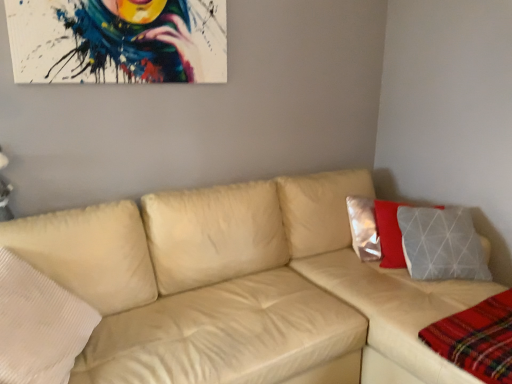
Find the location of a particular element. Image resolution: width=512 pixels, height=384 pixels. beige leather couch at center is located at coordinates (238, 286).

What do you see at coordinates (238, 286) in the screenshot? I see `beige leather couch at center` at bounding box center [238, 286].

In order to face beige leather couch at center, should I rotate leftwards or rightwards?

Turn right by 8.333 degrees to look at beige leather couch at center.

Describe the element at coordinates (477, 339) in the screenshot. I see `plaid fabric at lower right` at that location.

At what (x,y) coordinates should I click in order to perform the action: click on plaid fabric at lower right. Please return your answer as a coordinate pair (x, y). The height and width of the screenshot is (384, 512). Looking at the image, I should click on (477, 339).

Find the location of `beige leather couch at center`. beige leather couch at center is located at coordinates (238, 286).

Can you confirm if plaid fabric at lower right is positioned to the left of beige leather couch at center?

Incorrect, plaid fabric at lower right is not on the left side of beige leather couch at center.

Looking at this image, between plaid fabric at lower right and beige leather couch at center, which one is positioned in front?

Positioned in front is beige leather couch at center.

Does point (493, 320) appear closer or farther from the camera than point (50, 271)?

Point (493, 320) is farther from the camera than point (50, 271).

From the image's perspective, is plaid fabric at lower right below beige leather couch at center?

Yes.

From a real-world perspective, is plaid fabric at lower right above or below beige leather couch at center?

plaid fabric at lower right is situated higher than beige leather couch at center in the real world.

In the scene shown: Can you confirm if plaid fabric at lower right is thinner than beige leather couch at center?

Indeed, plaid fabric at lower right has a lesser width compared to beige leather couch at center.

Can you confirm if plaid fabric at lower right is taller than beige leather couch at center?

Incorrect, the height of plaid fabric at lower right is not larger of that of beige leather couch at center.

Is plaid fabric at lower right bigger or smaller than beige leather couch at center?

Clearly, plaid fabric at lower right is smaller in size than beige leather couch at center.

Is plaid fabric at lower right inside or outside of beige leather couch at center?

plaid fabric at lower right is inside beige leather couch at center.

Is plaid fabric at lower right placed right next to beige leather couch at center?

No.

Is plaid fabric at lower right facing away from beige leather couch at center?

Yes.

How different are the orientations of plaid fabric at lower right and beige leather couch at center in degrees?

0.00142 degrees separate the facing orientations of plaid fabric at lower right and beige leather couch at center.

How distant is plaid fabric at lower right from beige leather couch at center?

plaid fabric at lower right and beige leather couch at center are 22.18 inches apart from each other.

Where is `studio couch located above the plaid fabric at lower right (from the image's perspective)`? This screenshot has height=384, width=512. studio couch located above the plaid fabric at lower right (from the image's perspective) is located at coordinates (238, 286).

Is beige leather couch at center at the left side of plaid fabric at lower right?

Correct, you'll find beige leather couch at center to the left of plaid fabric at lower right.

Does beige leather couch at center lie behind plaid fabric at lower right?

No.

Between point (362, 175) and point (496, 343), which one is positioned behind?

The point (362, 175) is farther from the camera.

From the image's perspective, which is below, beige leather couch at center or plaid fabric at lower right?

plaid fabric at lower right appears lower in the image.

Based on the photo, from a real-world perspective, does beige leather couch at center sit lower than plaid fabric at lower right?

Correct, in the physical world, beige leather couch at center is lower than plaid fabric at lower right.

Looking at their sizes, would you say beige leather couch at center is wider or thinner than plaid fabric at lower right?

Considering their sizes, beige leather couch at center looks broader than plaid fabric at lower right.

Considering the sizes of objects beige leather couch at center and plaid fabric at lower right in the image provided, who is shorter, beige leather couch at center or plaid fabric at lower right?

Standing shorter between the two is plaid fabric at lower right.

Does beige leather couch at center have a larger size compared to plaid fabric at lower right?

Yes.

Is beige leather couch at center surrounding plaid fabric at lower right?

Yes, plaid fabric at lower right is a part of beige leather couch at center.

Is beige leather couch at center directly adjacent to plaid fabric at lower right?

No, beige leather couch at center is not making contact with plaid fabric at lower right.

Looking at this image, could you tell me if beige leather couch at center is turned towards plaid fabric at lower right?

Yes, beige leather couch at center is facing plaid fabric at lower right.

In order to click on plaid located below the beige leather couch at center (from the image's perspective) in this screenshot , I will do `click(477, 339)`.

You are a GUI agent. You are given a task and a screenshot of the screen. Output one action in this format:
    pyautogui.click(x=<x>, y=<y>)
    Task: Click on the studio couch above the plaid fabric at lower right (from the image's perspective)
    
    Given the screenshot: What is the action you would take?
    pyautogui.click(x=238, y=286)

Where is `plaid above the beige leather couch at center (from a real-world perspective)`? The width and height of the screenshot is (512, 384). plaid above the beige leather couch at center (from a real-world perspective) is located at coordinates (477, 339).